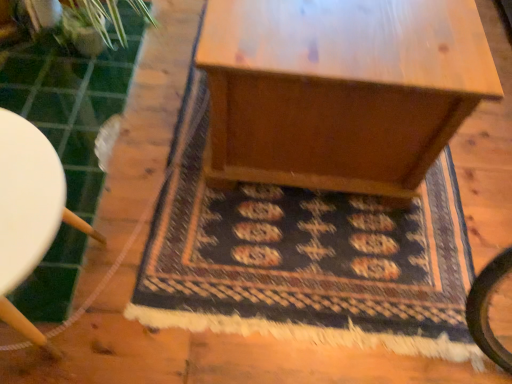
Question: Would you say white plastic stool at left contains wooden table at center?

Choices:
 (A) yes
 (B) no

Answer: (B)

Question: Does white plastic stool at left have a smaller size compared to wooden table at center?

Choices:
 (A) yes
 (B) no

Answer: (A)

Question: Can you confirm if white plastic stool at left is positioned to the left of wooden table at center?

Choices:
 (A) yes
 (B) no

Answer: (A)

Question: Can you confirm if white plastic stool at left is thinner than wooden table at center?

Choices:
 (A) no
 (B) yes

Answer: (B)

Question: From the image's perspective, is white plastic stool at left located above wooden table at center?

Choices:
 (A) no
 (B) yes

Answer: (A)

Question: From a real-world perspective, is white plastic stool at left beneath wooden table at center?

Choices:
 (A) no
 (B) yes

Answer: (B)

Question: Does white plastic stool at left have a greater width compared to dark blue woven rug at center?

Choices:
 (A) yes
 (B) no

Answer: (B)

Question: Can you confirm if white plastic stool at left is bigger than dark blue woven rug at center?

Choices:
 (A) yes
 (B) no

Answer: (A)

Question: Does white plastic stool at left touch dark blue woven rug at center?

Choices:
 (A) yes
 (B) no

Answer: (B)

Question: Is white plastic stool at left thinner than dark blue woven rug at center?

Choices:
 (A) yes
 (B) no

Answer: (A)

Question: From a real-world perspective, does white plastic stool at left stand above dark blue woven rug at center?

Choices:
 (A) no
 (B) yes

Answer: (B)

Question: From a real-world perspective, is white plastic stool at left physically below dark blue woven rug at center?

Choices:
 (A) no
 (B) yes

Answer: (A)

Question: Is dark blue woven rug at center next to white plastic stool at left and touching it?

Choices:
 (A) yes
 (B) no

Answer: (B)